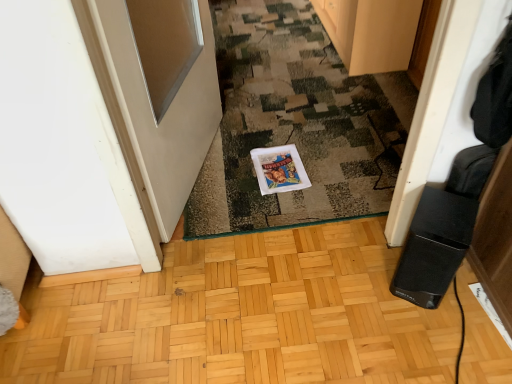
I want to click on free space to the back side of white glossy door at left, so click(x=251, y=104).